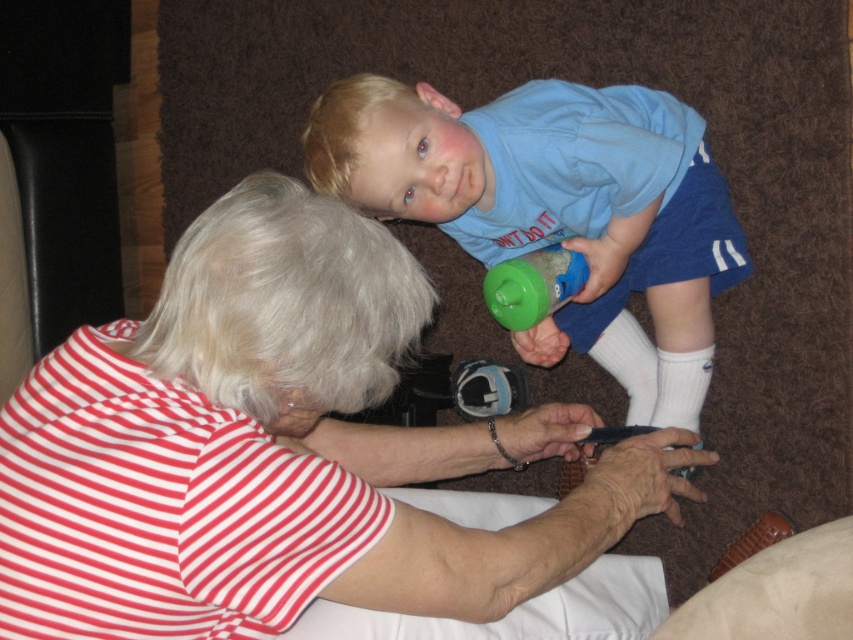
Can you confirm if striped cotton shirt at center is shorter than blue cotton shirt at upper center?

Indeed, striped cotton shirt at center has a lesser height compared to blue cotton shirt at upper center.

Does striped cotton shirt at center come behind blue cotton shirt at upper center?

No.

This screenshot has height=640, width=853. I want to click on striped cotton shirt at center, so click(288, 456).

Where is `striped cotton shirt at center`? This screenshot has height=640, width=853. striped cotton shirt at center is located at coordinates [x=288, y=456].

Between blue cotton shirt at upper center and green plastic sippy cup at center, which one appears on the left side from the viewer's perspective?

Positioned to the left is green plastic sippy cup at center.

Measure the distance between blue cotton shirt at upper center and camera.

→ 1.22 meters

Find the location of a particular element. blue cotton shirt at upper center is located at coordinates (556, 211).

Can you confirm if striped cotton shirt at center is positioned to the right of green plastic sippy cup at center?

No, striped cotton shirt at center is not to the right of green plastic sippy cup at center.

What do you see at coordinates (288, 456) in the screenshot? This screenshot has width=853, height=640. I see `striped cotton shirt at center` at bounding box center [288, 456].

Locate an element on the screen. striped cotton shirt at center is located at coordinates (288, 456).